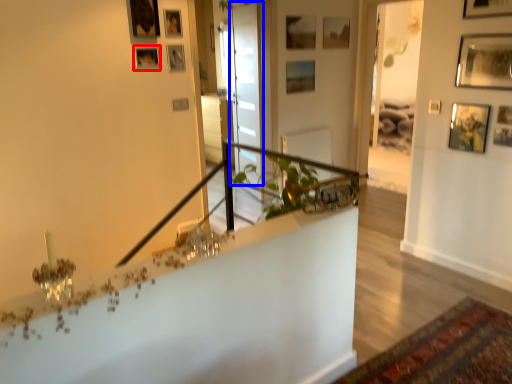
Question: Which point is further to the camera, picture frame (highlighted by a red box) or glass door (highlighted by a blue box)?

Choices:
 (A) picture frame
 (B) glass door

Answer: (B)